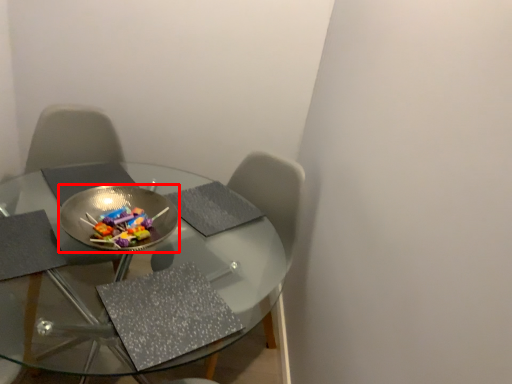
Question: From the image's perspective, considering the relative positions of bowl (annotated by the red box) and table in the image provided, where is bowl (annotated by the red box) located with respect to the staircase?

Choices:
 (A) above
 (B) below

Answer: (A)